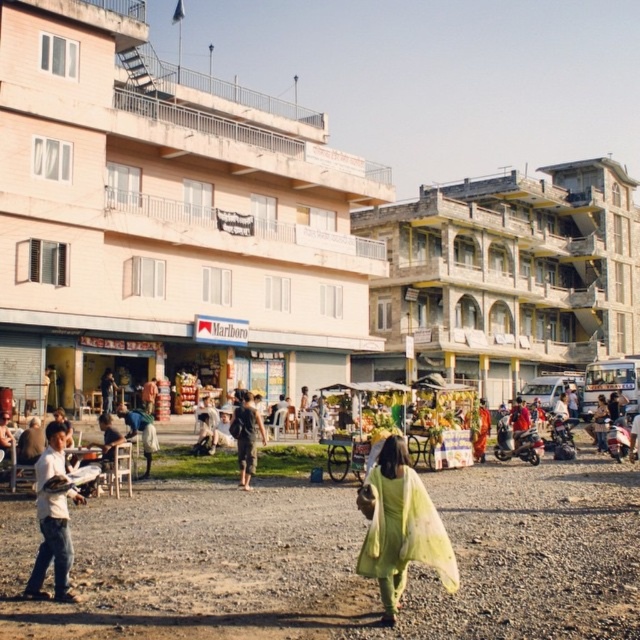
In the scene shown: Is white cotton shirt at lower left above dark brown fabric pants at center?

No, white cotton shirt at lower left is not above dark brown fabric pants at center.

Which of these two, white cotton shirt at lower left or dark brown fabric pants at center, stands taller?

white cotton shirt at lower left

Where is `white cotton shirt at lower left`? The width and height of the screenshot is (640, 640). white cotton shirt at lower left is located at coordinates (52, 516).

Can you confirm if light green fabric at center is positioned to the left of white cotton shirt at lower left?

In fact, light green fabric at center is to the right of white cotton shirt at lower left.

Is light green fabric at center positioned before white cotton shirt at lower left?

Yes, light green fabric at center is in front of white cotton shirt at lower left.

Which is behind, point (448, 550) or point (65, 433)?

Positioned behind is point (65, 433).

Find the location of a particular element. Image resolution: width=640 pixels, height=640 pixels. light green fabric at center is located at coordinates (401, 528).

Is point (312, 552) positioned behind point (392, 604)?

Yes, point (312, 552) is farther from viewer.

Consider the image. Can you confirm if dusty gravel field at center is bigger than light green fabric at center?

Yes.

Does point (106, 557) come closer to viewer compared to point (420, 516)?

No, (106, 557) is behind (420, 516).

What are the coordinates of `dusty gravel field at center` in the screenshot? It's located at (340, 561).